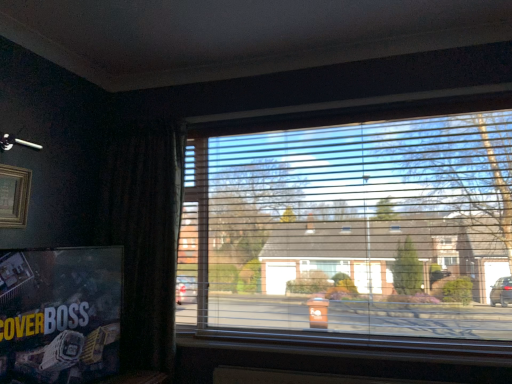
Question: Considering the positions of point (172, 294) and point (274, 218), is point (172, 294) closer or farther from the camera than point (274, 218)?

Choices:
 (A) farther
 (B) closer

Answer: (B)

Question: Considering the relative positions of dark fabric curtain at left and transparent plastic blinds at center in the image provided, is dark fabric curtain at left to the left or to the right of transparent plastic blinds at center?

Choices:
 (A) left
 (B) right

Answer: (A)

Question: Which object is positioned farthest from the transparent plastic blinds at center?

Choices:
 (A) wooden picture frame at upper left
 (B) wooden at lower center
 (C) matte black poster at lower left
 (D) dark fabric curtain at left

Answer: (A)

Question: Considering the real-world distances, which object is closest to the wooden picture frame at upper left?

Choices:
 (A) transparent plastic blinds at center
 (B) wooden at lower center
 (C) dark fabric curtain at left
 (D) matte black poster at lower left

Answer: (D)